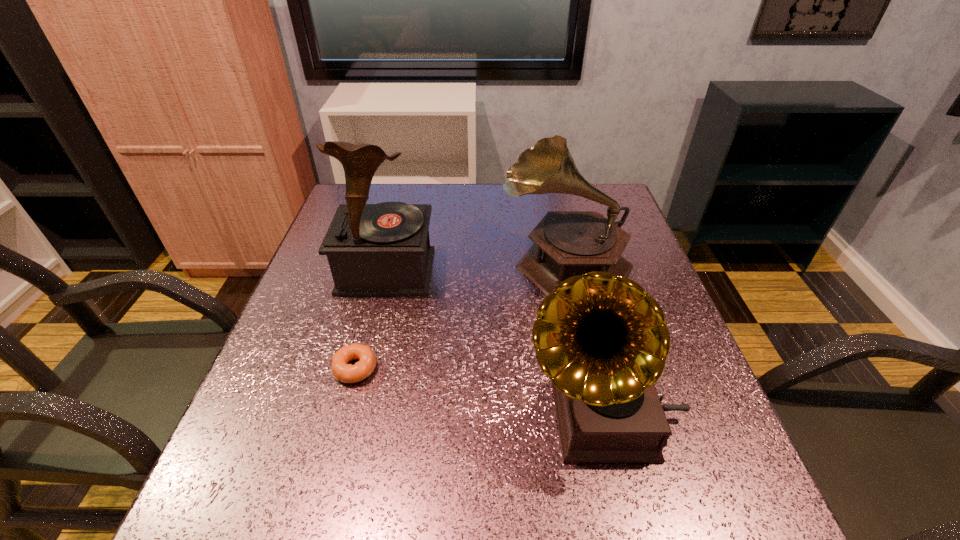
The width and height of the screenshot is (960, 540). What are the coordinates of `vacant area that lies between the leftmost phonograph record and the doughnut` in the screenshot? It's located at tap(371, 320).

I want to click on empty location between the leftmost phonograph record and the nearest phonograph record, so click(494, 343).

Image resolution: width=960 pixels, height=540 pixels. I want to click on free space between the leftmost phonograph record and the nearest phonograph record, so click(494, 343).

Identify the location of free space that is in between the doughnut and the nearest phonograph record. This screenshot has width=960, height=540. (479, 392).

Locate which object ranks second in proximity to the leftmost phonograph record. Please provide its 2D coordinates. Your answer should be formatted as a tuple, i.e. [(x, y)], where the tuple contains the x and y coordinates of a point satisfying the conditions above.

[(566, 243)]

Identify which object is located as the second nearest to the doughnut. Please provide its 2D coordinates. Your answer should be formatted as a tuple, i.e. [(x, y)], where the tuple contains the x and y coordinates of a point satisfying the conditions above.

[(602, 339)]

Select which phonograph record appears as the closest to the nearest phonograph record. Please provide its 2D coordinates. Your answer should be formatted as a tuple, i.e. [(x, y)], where the tuple contains the x and y coordinates of a point satisfying the conditions above.

[(566, 243)]

Identify which phonograph record is the nearest to the shortest object. Please provide its 2D coordinates. Your answer should be formatted as a tuple, i.e. [(x, y)], where the tuple contains the x and y coordinates of a point satisfying the conditions above.

[(383, 249)]